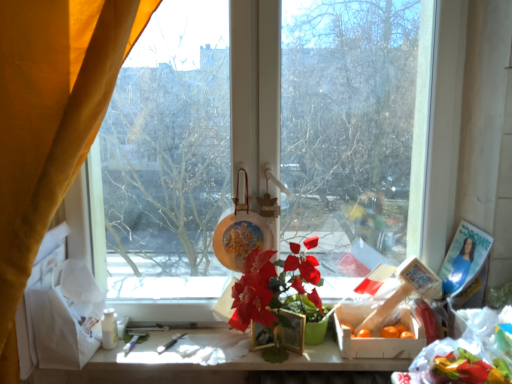
Locate an element on the screen. This screenshot has width=512, height=384. white matte table at center is located at coordinates click(206, 366).

The image size is (512, 384). Describe the element at coordinates (376, 335) in the screenshot. I see `wooden crate of oranges at center` at that location.

This screenshot has height=384, width=512. What are the coordinates of `transparent glass window at center` in the screenshot? It's located at (342, 124).

Is wooden crate of oranges at center not near matte plastic flower at center?

wooden crate of oranges at center is actually quite close to matte plastic flower at center.

From the picture: Does wooden crate of oranges at center have a smaller size compared to matte plastic flower at center?

Yes, wooden crate of oranges at center is smaller than matte plastic flower at center.

Who is more distant, wooden crate of oranges at center or matte plastic flower at center?

wooden crate of oranges at center is behind.

Considering the relative positions of wooden crate of oranges at center and velvet yellow curtain at left in the image provided, is wooden crate of oranges at center behind velvet yellow curtain at left?

Yes, the depth of wooden crate of oranges at center is greater than that of velvet yellow curtain at left.

Is wooden crate of oranges at center not close to velvet yellow curtain at left?

Yes, wooden crate of oranges at center and velvet yellow curtain at left are quite far apart.

Who is taller, wooden crate of oranges at center or velvet yellow curtain at left?

Standing taller between the two is velvet yellow curtain at left.

Is wooden crate of oranges at center oriented away from velvet yellow curtain at left?

No, velvet yellow curtain at left is not at the back of wooden crate of oranges at center.

Is the surface of wooden crate of oranges at center in direct contact with white matte table at center?

They are not placed beside each other.

From a real-world perspective, which object stands above the other?

wooden crate of oranges at center is physically above.

How different are the orientations of wooden crate of oranges at center and white matte table at center in degrees?

There is a 2.53-degree angle between the facing directions of wooden crate of oranges at center and white matte table at center.

Does point (402, 311) come farther from viewer compared to point (230, 365)?

Yes, point (402, 311) is behind point (230, 365).

Is matte plastic flower at center oriented towards velvet yellow curtain at left?

No, matte plastic flower at center is not oriented towards velvet yellow curtain at left.

From the image's perspective, between matte plastic flower at center and velvet yellow curtain at left, who is located below?

From the image's view, matte plastic flower at center is below.

Is matte plastic flower at center behind velvet yellow curtain at left?

Yes, matte plastic flower at center is further from the camera.

Does matte plastic flower at center have a lesser width compared to velvet yellow curtain at left?

Yes, matte plastic flower at center is thinner than velvet yellow curtain at left.

Looking at this image, which is closer to the camera, (292, 246) or (143, 373)?

The point (292, 246) is in front.

Considering the sizes of objects matte plastic flower at center and white matte table at center in the image provided, who is bigger, matte plastic flower at center or white matte table at center?

With larger size is matte plastic flower at center.

From the image's perspective, which is above, matte plastic flower at center or white matte table at center?

From the image's view, matte plastic flower at center is above.

Considering the relative positions of matte plastic flower at center and white matte table at center in the image provided, is matte plastic flower at center to the left of white matte table at center from the viewer's perspective?

No.

Does velvet yellow curtain at left have a greater height compared to transparent glass window at center?

Indeed, velvet yellow curtain at left has a greater height compared to transparent glass window at center.

At what (x,y) coordinates should I click in order to perform the action: click on curtain that is under the transparent glass window at center (from a real-world perspective). Please return your answer as a coordinate pair (x, y). Looking at the image, I should click on (50, 121).

Considering their positions, is velvet yellow curtain at left located in front of or behind transparent glass window at center?

velvet yellow curtain at left is in front of transparent glass window at center.

Is velvet yellow curtain at left inside or outside of transparent glass window at center?

velvet yellow curtain at left exists outside the volume of transparent glass window at center.

From a real-world perspective, is white matte table at center located higher than matte plastic flower at center?

No.

Is white matte table at center next to matte plastic flower at center?

No, white matte table at center is not with matte plastic flower at center.

Which object is wider, white matte table at center or matte plastic flower at center?

matte plastic flower at center.

Identify the location of flower box below the matte plastic flower at center (from the image's perspective). (376, 335).

Identify the location of flower box below the velvet yellow curtain at left (from a real-world perspective). This screenshot has height=384, width=512. (376, 335).

Estimate the real-world distances between objects in this image. Which object is closer to white matte table at center, velvet yellow curtain at left or matte plastic flower at center?

The object closer to white matte table at center is matte plastic flower at center.

Consider the image. Which object lies further to the anchor point wooden crate of oranges at center, transparent glass window at center or matte plastic flower at center?

The object further to wooden crate of oranges at center is transparent glass window at center.

Based on their spatial positions, is velvet yellow curtain at left or matte plastic flower at center further from transparent glass window at center?

The object further to transparent glass window at center is velvet yellow curtain at left.

Estimate the real-world distances between objects in this image. Which object is closer to matte plastic flower at center, velvet yellow curtain at left or wooden crate of oranges at center?

The object closer to matte plastic flower at center is wooden crate of oranges at center.

In the scene shown: Looking at the image, which one is located further to velvet yellow curtain at left, transparent glass window at center or wooden crate of oranges at center?

wooden crate of oranges at center lies further to velvet yellow curtain at left than the other object.

Which object lies further to the anchor point velvet yellow curtain at left, matte plastic flower at center or transparent glass window at center?

matte plastic flower at center is further to velvet yellow curtain at left.

When comparing their distances from velvet yellow curtain at left, does matte plastic flower at center or wooden crate of oranges at center seem closer?

The object closer to velvet yellow curtain at left is matte plastic flower at center.

Looking at the image, which one is located closer to matte plastic flower at center, transparent glass window at center or wooden crate of oranges at center?

Among the two, wooden crate of oranges at center is located nearer to matte plastic flower at center.

Locate an element on the screen. This screenshot has height=384, width=512. table located between velvet yellow curtain at left and wooden crate of oranges at center in the left-right direction is located at coordinates (206, 366).

The height and width of the screenshot is (384, 512). What are the coordinates of `flower between transparent glass window at center and white matte table at center in the up-down direction` in the screenshot? It's located at (275, 288).

Find the location of `table between velvet yellow curtain at left and matte plastic flower at center from left to right`. table between velvet yellow curtain at left and matte plastic flower at center from left to right is located at coordinates pyautogui.click(x=206, y=366).

This screenshot has width=512, height=384. Find the location of `window located between velvet yellow curtain at left and wooden crate of oranges at center in the left-right direction`. window located between velvet yellow curtain at left and wooden crate of oranges at center in the left-right direction is located at coordinates (342, 124).